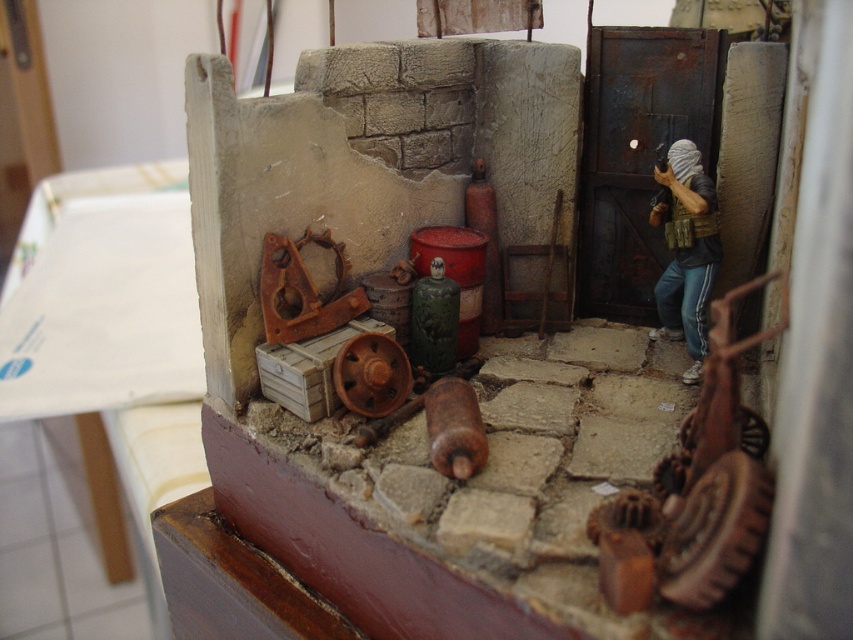
Question: Which point appears closest to the camera in this image?

Choices:
 (A) (689, 355)
 (B) (692, 600)

Answer: (B)

Question: Which object is closer to the camera taking this photo?

Choices:
 (A) camouflage fabric figure at right
 (B) wooden gear at lower right

Answer: (B)

Question: Which point is closer to the camera taking this photo?

Choices:
 (A) (709, 460)
 (B) (666, 184)

Answer: (A)

Question: Can you confirm if wooden gear at lower right is positioned to the right of camouflage fabric figure at right?

Choices:
 (A) yes
 (B) no

Answer: (B)

Question: Does wooden gear at lower right appear on the right side of camouflage fabric figure at right?

Choices:
 (A) yes
 (B) no

Answer: (B)

Question: Can you confirm if wooden gear at lower right is bigger than camouflage fabric figure at right?

Choices:
 (A) yes
 (B) no

Answer: (A)